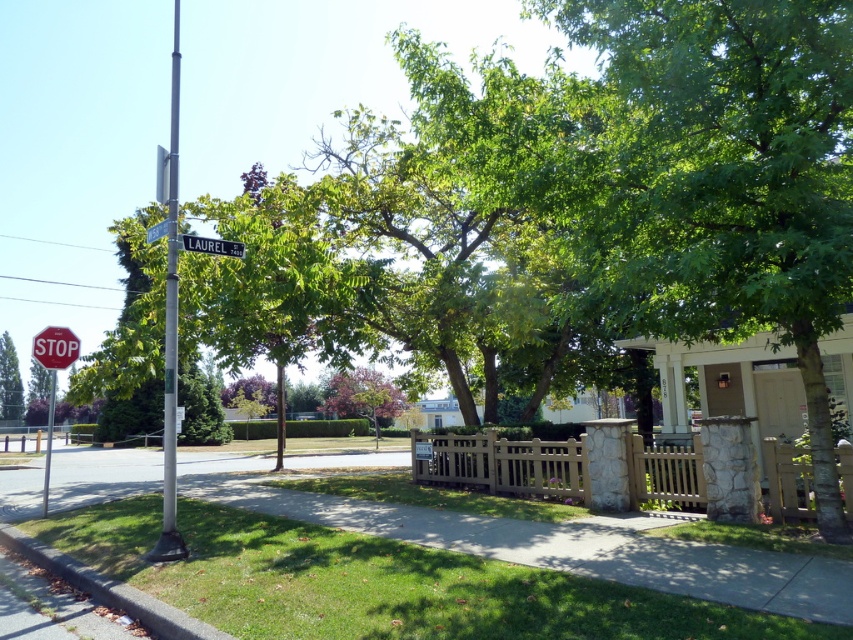
Can you confirm if red matte stop sign at left is wider than metallic pole at left?

No.

Who is shorter, red matte stop sign at left or metallic pole at left?

Standing shorter between the two is red matte stop sign at left.

Does point (64, 349) come in front of point (50, 435)?

Yes, point (64, 349) is closer to viewer.

The image size is (853, 640). Identify the location of red matte stop sign at left. (55, 348).

Who is more forward, (170, 636) or (236, 248)?

Point (170, 636)

Is point (231, 637) farther from camera compared to point (225, 253)?

No, (231, 637) is closer to viewer.

Is point (161, 616) positioned after point (234, 244)?

No, (161, 616) is in front of (234, 244).

You are a GUI agent. You are given a task and a screenshot of the screen. Output one action in this format:
    pyautogui.click(x=<x>, y=<y>)
    Task: Click on the gray concrete curb at lower left
    The width and height of the screenshot is (853, 640).
    Given the screenshot: What is the action you would take?
    pyautogui.click(x=111, y=589)

Can you confirm if metallic pole at left is positioned to the right of metallic silver street sign at upper center?

No, metallic pole at left is not to the right of metallic silver street sign at upper center.

Consider the image. Can you confirm if metallic pole at left is wider than metallic silver street sign at upper center?

Indeed, metallic pole at left has a greater width compared to metallic silver street sign at upper center.

You are a GUI agent. You are given a task and a screenshot of the screen. Output one action in this format:
    pyautogui.click(x=<x>, y=<y>)
    Task: Click on the metallic pole at left
    
    Given the screenshot: What is the action you would take?
    pyautogui.click(x=48, y=440)